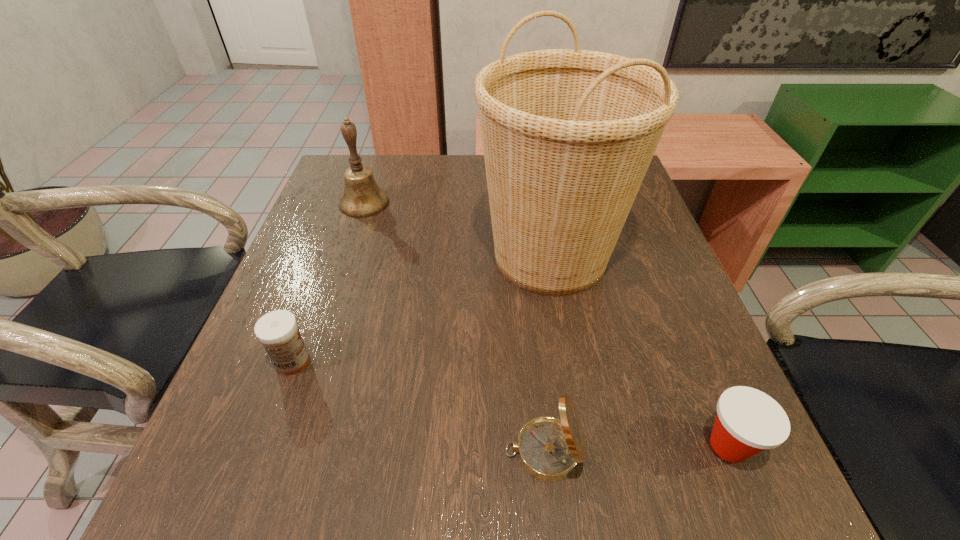
I want to click on vacant point located between the bell and the medicine, so click(x=328, y=282).

This screenshot has width=960, height=540. I want to click on free space between the compass and the third nearest object, so click(x=419, y=407).

This screenshot has width=960, height=540. In order to click on free space that is in between the tallest object and the second tallest object in this screenshot , I will do `click(457, 230)`.

Identify the location of free space between the Dixie cup and the second tallest object. The width and height of the screenshot is (960, 540). (546, 324).

The width and height of the screenshot is (960, 540). In order to click on free space between the fourth shortest object and the Dixie cup in this screenshot , I will do `click(546, 324)`.

At what (x,y) coordinates should I click in order to perform the action: click on vacant region between the third nearest object and the tallest object. Please return your answer as a coordinate pair (x, y). Looking at the image, I should click on (421, 309).

Identify which object is the fourth nearest to the bell. Please provide its 2D coordinates. Your answer should be formatted as a tuple, i.e. [(x, y)], where the tuple contains the x and y coordinates of a point satisfying the conditions above.

[(748, 421)]

Point out which object is positioned as the third nearest to the rightmost object. Please provide its 2D coordinates. Your answer should be formatted as a tuple, i.e. [(x, y)], where the tuple contains the x and y coordinates of a point satisfying the conditions above.

[(278, 331)]

Image resolution: width=960 pixels, height=540 pixels. What are the coordinates of `free spot that satisfies the following two spatial constraints: 1. on the front side of the rightmost object; 2. on the left side of the basket` in the screenshot? It's located at (x=583, y=446).